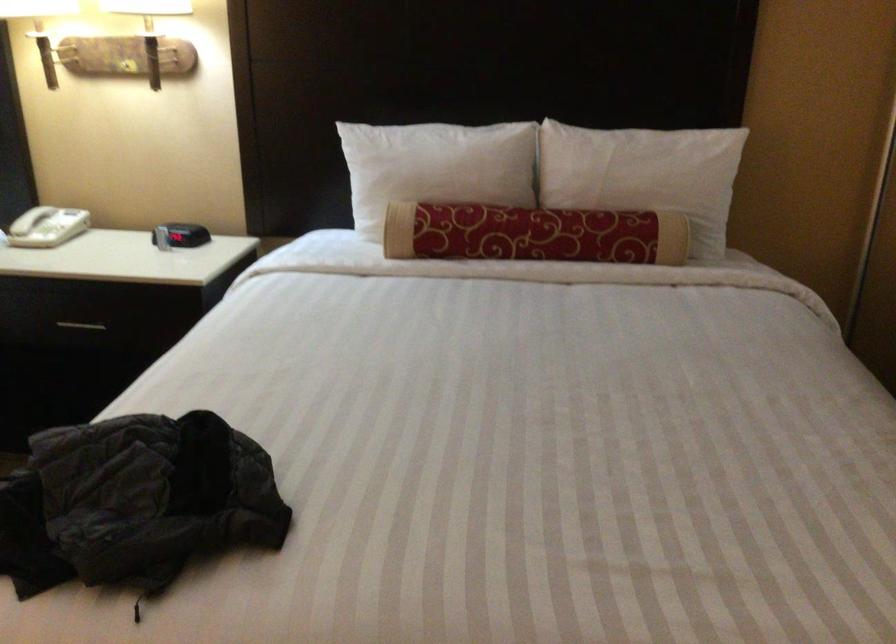
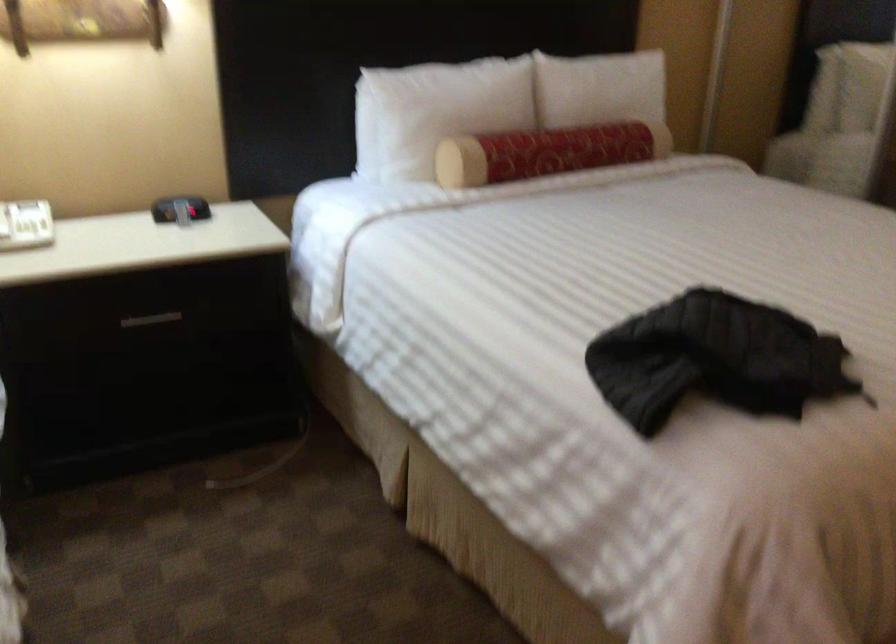
In the second image, find the point that corresponds to the point at 604,169 in the first image.

(599, 88)